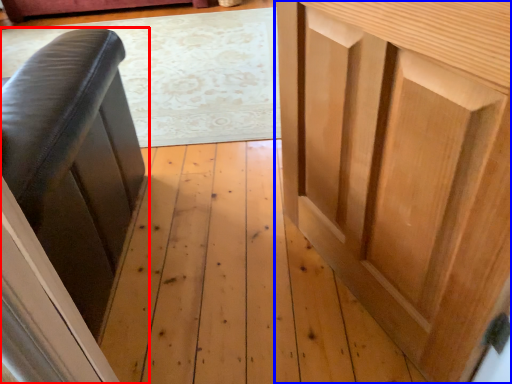
Question: Which of the following is the closest to the observer, furniture (highlighted by a red box) or cupboard (highlighted by a blue box)?

Choices:
 (A) furniture
 (B) cupboard

Answer: (B)